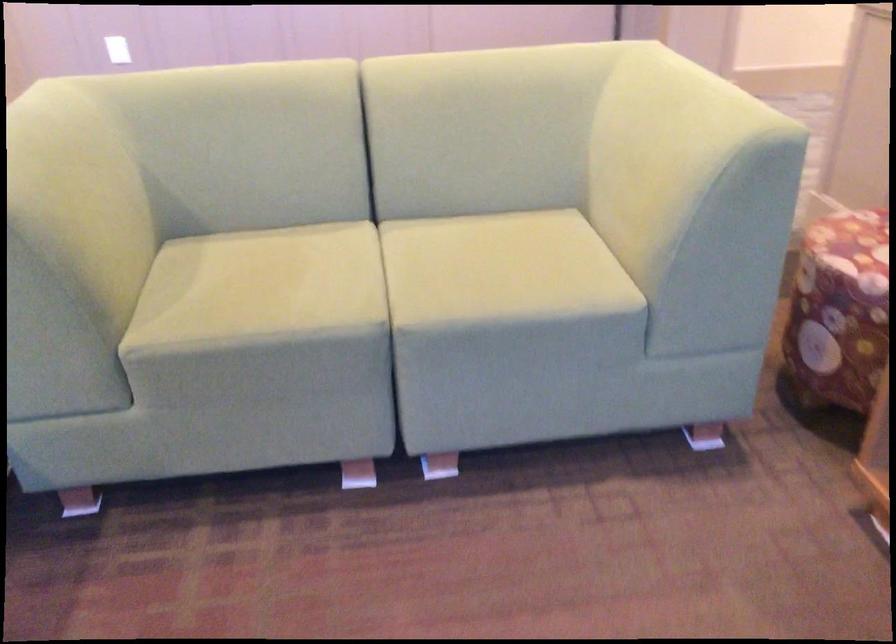
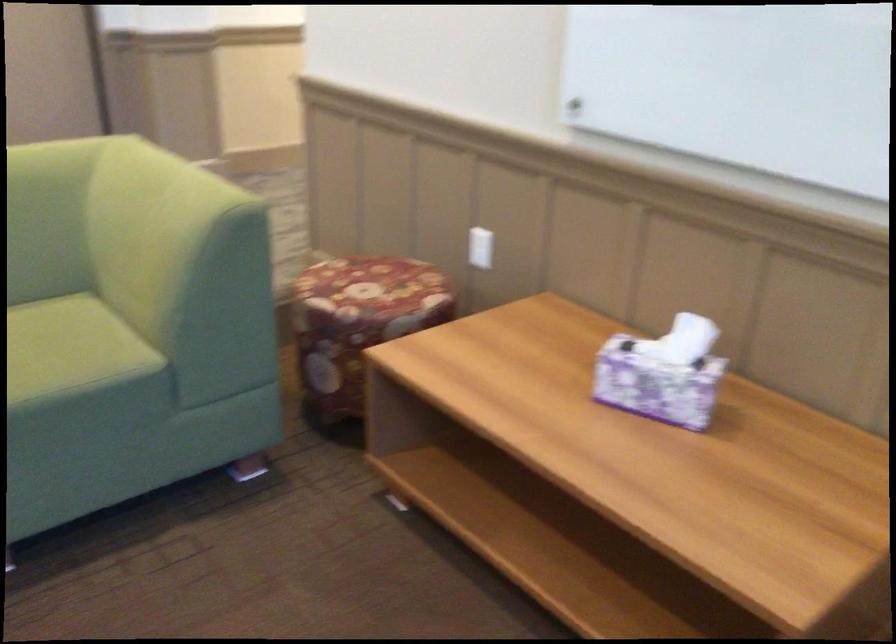
The point at (x=703, y=95) is marked in the first image. Where is the corresponding point in the second image?

(181, 184)